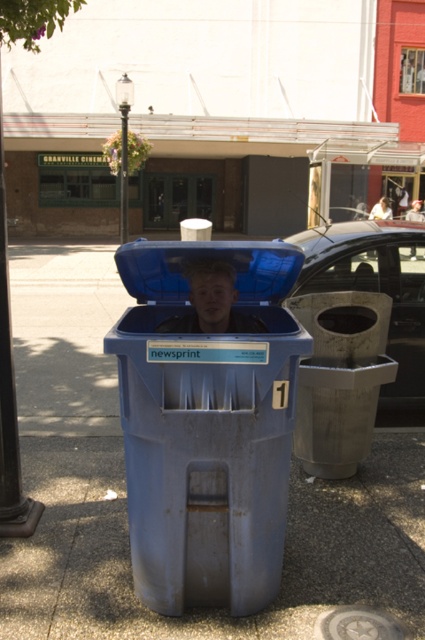
Question: Which object is farther from the camera taking this photo?

Choices:
 (A) rusty metal trash can at center
 (B) gray concrete pavement at lower center
 (C) black polished pole at upper left

Answer: (A)

Question: Can you confirm if gray concrete pavement at lower center is positioned above black polished pole at upper left?

Choices:
 (A) yes
 (B) no

Answer: (B)

Question: Can you confirm if rusty metal trash can at center is positioned to the right of smooth blue shirt at center?

Choices:
 (A) no
 (B) yes

Answer: (B)

Question: Is blue plastic recycling bin at center thinner than rusty metal trash can at center?

Choices:
 (A) yes
 (B) no

Answer: (B)

Question: Which point is closer to the camera taking this photo?

Choices:
 (A) click(x=249, y=301)
 (B) click(x=23, y=10)

Answer: (A)

Question: Which of these objects is positioned farthest from the blue plastic recycling bin at center?

Choices:
 (A) smooth blue shirt at center
 (B) metallic gray car at center
 (C) gray concrete pavement at lower center
 (D) rusty metal trash can at center

Answer: (B)